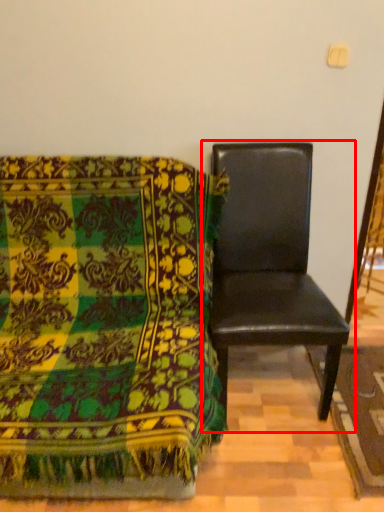
Question: Where is chair (annotated by the red box) located in relation to chair in the image?

Choices:
 (A) left
 (B) right

Answer: (B)